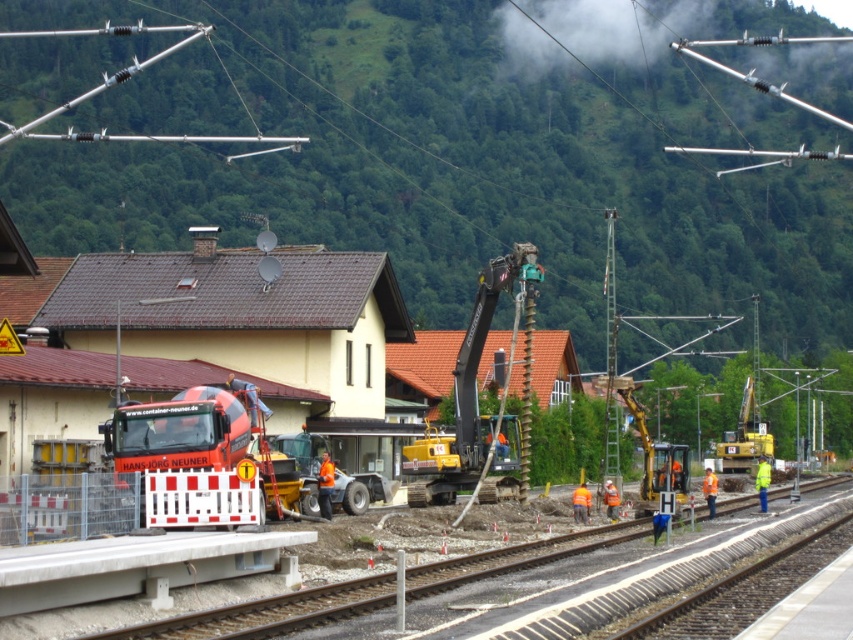
Question: Among these points, which one is farthest from the camera?

Choices:
 (A) (432, 480)
 (B) (619, 380)

Answer: (A)

Question: Among these objects, which one is nearest to the camera?

Choices:
 (A) teal metallic excavator at center
 (B) metallic yellow excavator at center
 (C) yellow metallic excavator at center-right

Answer: (A)

Question: In this image, where is teal metallic excavator at center located relative to metallic yellow excavator at center?

Choices:
 (A) above
 (B) below

Answer: (A)

Question: Does metallic yellow excavator at center have a smaller size compared to yellow metallic excavator at center-right?

Choices:
 (A) yes
 (B) no

Answer: (B)

Question: Can you confirm if teal metallic excavator at center is positioned to the right of metallic yellow excavator at center?

Choices:
 (A) yes
 (B) no

Answer: (B)

Question: Which of these objects is positioned farthest from the yellow metallic excavator at center-right?

Choices:
 (A) metallic yellow excavator at center
 (B) teal metallic excavator at center

Answer: (B)